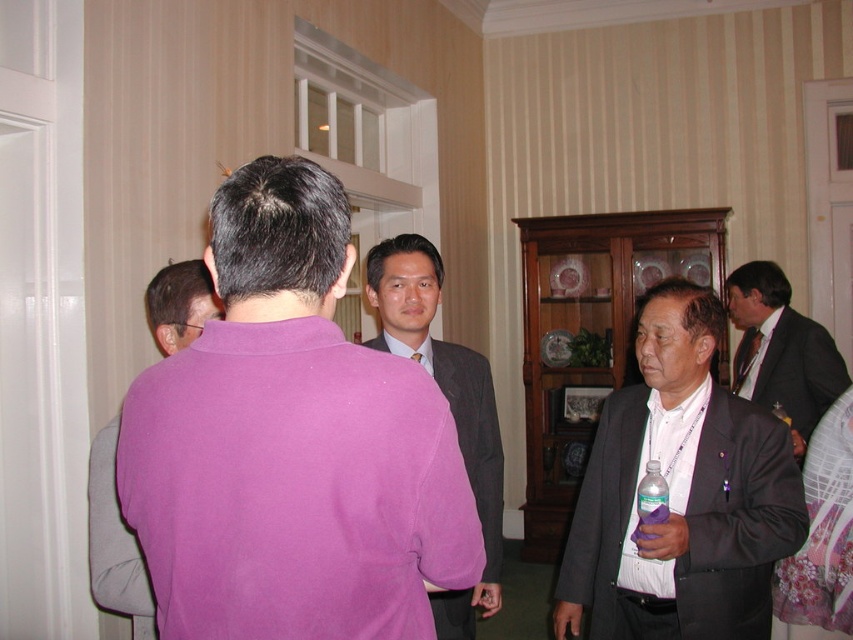
Question: Is matte gray suit at center wider than pink fabric shirt at center?

Choices:
 (A) yes
 (B) no

Answer: (A)

Question: Estimate the real-world distances between objects in this image. Which object is closer to the purple cotton shirt at center?

Choices:
 (A) matte black suit at right
 (B) matte gray suit at center
 (C) clear plastic bottle at lower right
 (D) purple fleece sweater at left

Answer: (D)

Question: Can you confirm if matte black suit at right is positioned above purple fleece sweater at left?

Choices:
 (A) yes
 (B) no

Answer: (B)

Question: Which object is closer to the camera taking this photo?

Choices:
 (A) purple cotton shirt at center
 (B) matte black suit at right
 (C) matte gray suit at center
 (D) purple fleece sweater at left

Answer: (A)

Question: From the image, what is the correct spatial relationship of matte black suit at right in relation to matte gray suit at center?

Choices:
 (A) left
 (B) right

Answer: (B)

Question: Estimate the real-world distances between objects in this image. Which object is farther from the matte black suit at right?

Choices:
 (A) purple fleece sweater at left
 (B) clear plastic bottle at lower right
 (C) matte gray suit at center

Answer: (A)